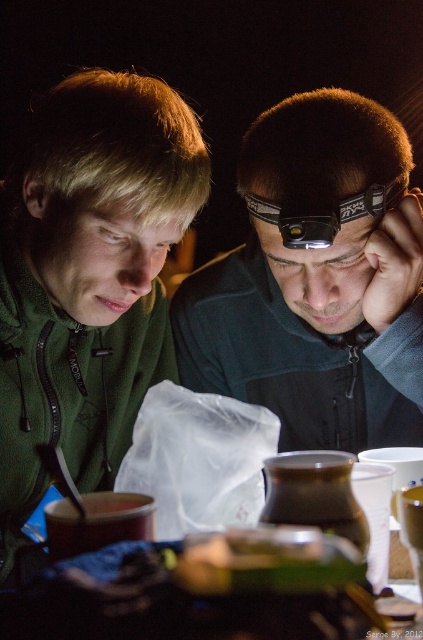
You are a hiker who needs to choose between the matte black headlamp at center and the black plastic goggles at center for your upcoming night hike. Considering their sizes, which item would you prioritize packing if you have limited space in your backpack?

The matte black headlamp at center has a larger size compared to black plastic goggles at center, so you should prioritize packing the black plastic goggles at center as it takes up less space in your backpack.

You are standing at the point labeled as point (195,536) and want to move to the point labeled as point (324,160). Based on the scene description, can you determine if you need to walk forward or backward to reach your destination?

Since point (324,160) is behind point (195,536), you need to walk backward to reach point (324,160) from your current position at point (195,536).